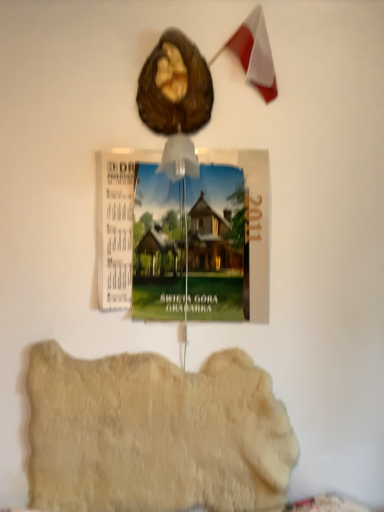
Question: Is wooden postcard at center at the right side of fuzzy beige rug at lower center?

Choices:
 (A) yes
 (B) no

Answer: (A)

Question: Does wooden postcard at center appear on the left side of fuzzy beige rug at lower center?

Choices:
 (A) no
 (B) yes

Answer: (A)

Question: Is wooden postcard at center turned away from fuzzy beige rug at lower center?

Choices:
 (A) no
 (B) yes

Answer: (A)

Question: From a real-world perspective, is wooden postcard at center located higher than fuzzy beige rug at lower center?

Choices:
 (A) yes
 (B) no

Answer: (A)

Question: Is wooden postcard at center positioned beyond the bounds of fuzzy beige rug at lower center?

Choices:
 (A) no
 (B) yes

Answer: (B)

Question: From a real-world perspective, is wooden postcard at center physically located above or below fuzzy beige rug at lower center?

Choices:
 (A) below
 (B) above

Answer: (B)

Question: From the image's perspective, is wooden postcard at center located above or below fuzzy beige rug at lower center?

Choices:
 (A) below
 (B) above

Answer: (B)

Question: Is wooden postcard at center in front of or behind fuzzy beige rug at lower center in the image?

Choices:
 (A) front
 (B) behind

Answer: (A)

Question: Based on their sizes in the image, would you say wooden postcard at center is bigger or smaller than fuzzy beige rug at lower center?

Choices:
 (A) big
 (B) small

Answer: (B)

Question: Is fuzzy beige rug at lower center taller or shorter than shiny brown nut at upper center?

Choices:
 (A) short
 (B) tall

Answer: (B)

Question: Is fuzzy beige rug at lower center situated inside shiny brown nut at upper center or outside?

Choices:
 (A) inside
 (B) outside

Answer: (B)

Question: From the image's perspective, is fuzzy beige rug at lower center located above or below shiny brown nut at upper center?

Choices:
 (A) above
 (B) below

Answer: (B)

Question: Based on their positions, is fuzzy beige rug at lower center located to the left or right of shiny brown nut at upper center?

Choices:
 (A) right
 (B) left

Answer: (B)

Question: From the image's perspective, is shiny brown nut at upper center located above or below fuzzy beige rug at lower center?

Choices:
 (A) above
 (B) below

Answer: (A)

Question: Would you say shiny brown nut at upper center is to the left or to the right of fuzzy beige rug at lower center in the picture?

Choices:
 (A) right
 (B) left

Answer: (A)